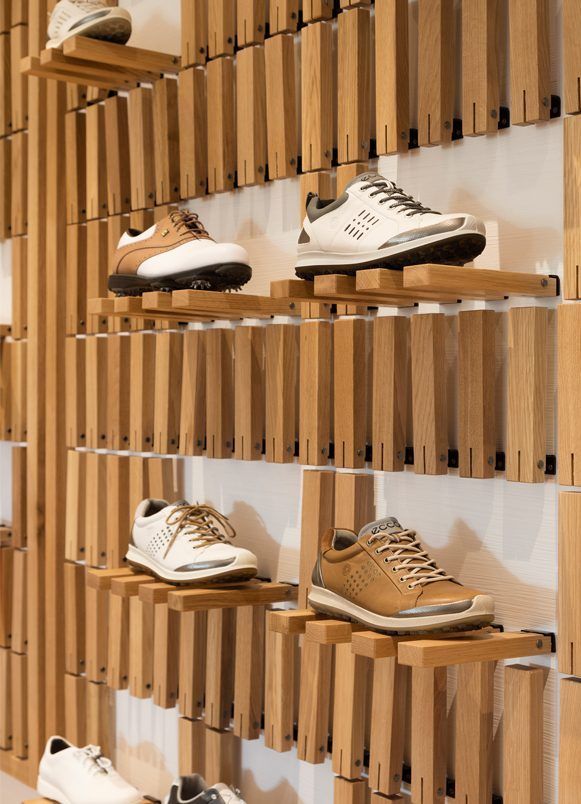
Identify the location of left shoes on a store wall. (58, 39), (162, 252), (372, 223), (396, 576), (192, 544), (87, 772), (217, 786).